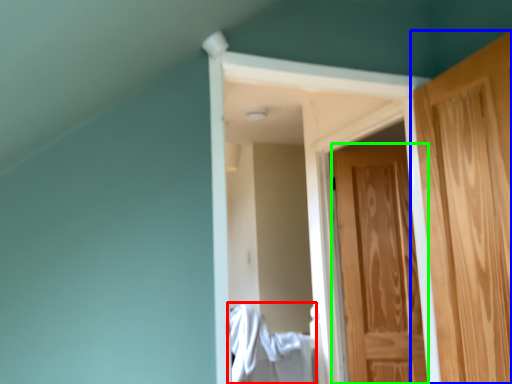
Question: Which is farther away from laundry (highlighted by a red box)? door (highlighted by a blue box) or door (highlighted by a green box)?

Choices:
 (A) door
 (B) door

Answer: (A)